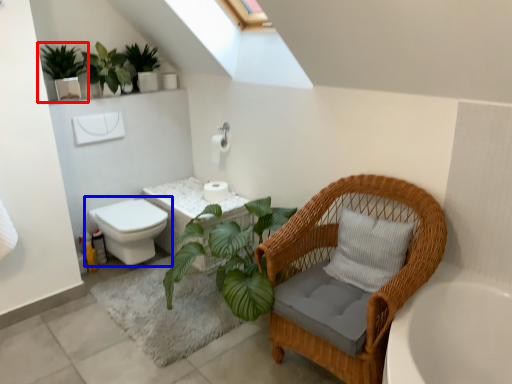
Question: Among these objects, which one is nearest to the camera, houseplant (highlighted by a red box) or toilet (highlighted by a blue box)?

Choices:
 (A) houseplant
 (B) toilet

Answer: (A)